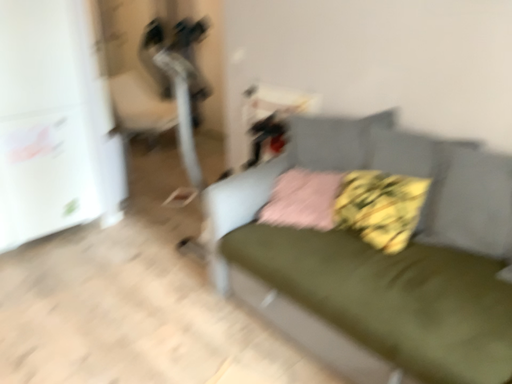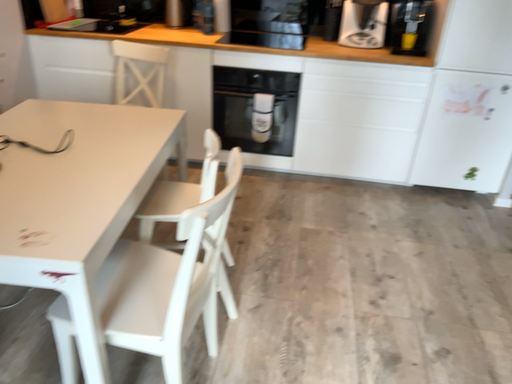
Question: Which way did the camera rotate in the video?

Choices:
 (A) rotated left
 (B) rotated right

Answer: (A)